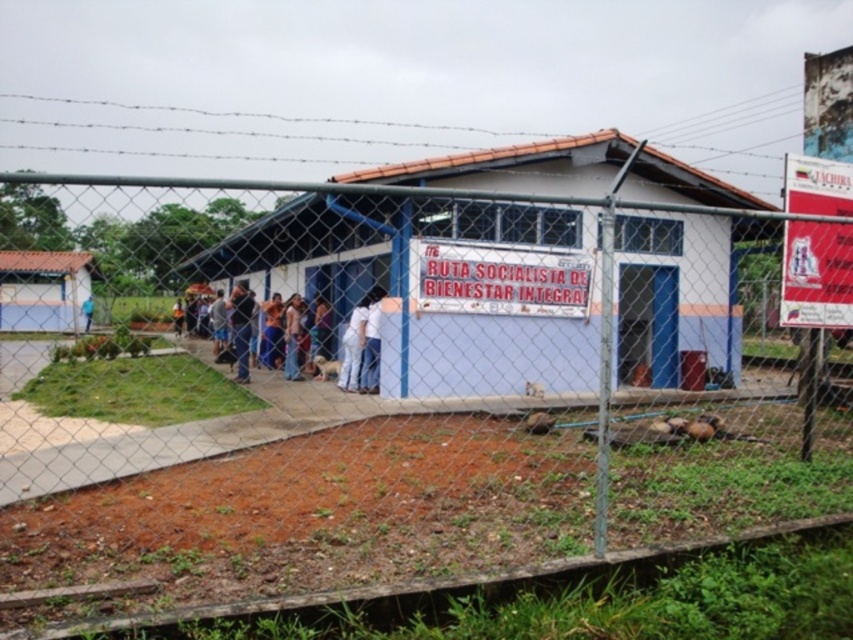
Locate an element on the screen. The height and width of the screenshot is (640, 853). white painted wood hut at center is located at coordinates (399, 292).

Who is positioned more to the right, white painted wood hut at center or white cotton shirt at center?

From the viewer's perspective, white painted wood hut at center appears more on the right side.

Locate an element on the screen. This screenshot has width=853, height=640. white painted wood hut at center is located at coordinates coord(399,292).

Between white painted wood hut at center and blue fabric shirt at left, which one is positioned lower?

blue fabric shirt at left is lower down.

Is white painted wood hut at center thinner than blue fabric shirt at left?

In fact, white painted wood hut at center might be wider than blue fabric shirt at left.

This screenshot has width=853, height=640. I want to click on white painted wood hut at center, so click(x=399, y=292).

Can you confirm if matte white hut at left is bigger than white cotton shirt at center?

Yes.

Between point (44, 276) and point (219, 356), which one is positioned in front?

Point (219, 356) is in front.

Who is more forward, (57, 300) or (234, 298)?

Point (234, 298) is more forward.

Where is `matte white hut at left`? This screenshot has height=640, width=853. matte white hut at left is located at coordinates (44, 289).